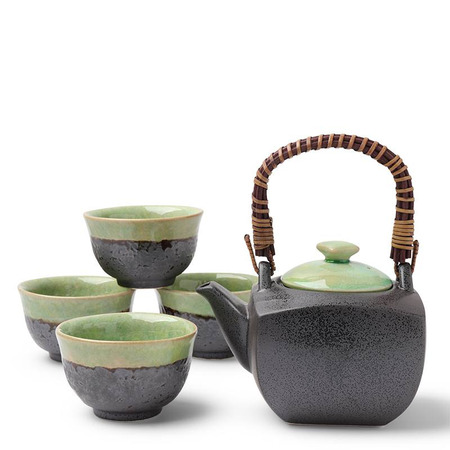
At what (x,y) coordinates should I click in order to perform the action: click on cups. Please return your answer as a coordinate pair (x, y). Looking at the image, I should click on (83, 301), (139, 252), (176, 299), (127, 354).